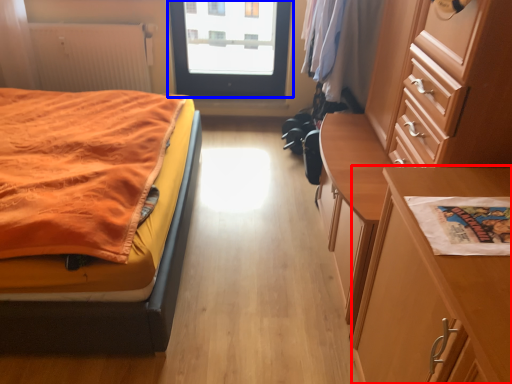
Question: Which object appears closest to the camera in this image, table (highlighted by a red box) or door (highlighted by a blue box)?

Choices:
 (A) table
 (B) door

Answer: (A)